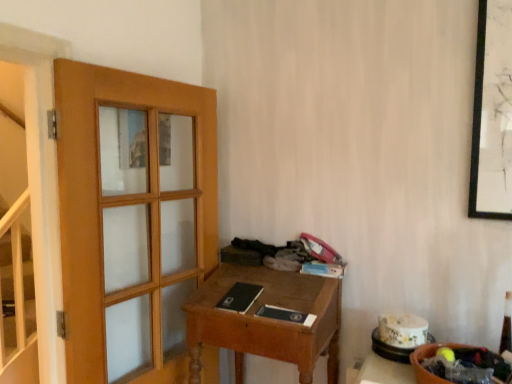
Question: Should I look upward or downward to see wooden desk at center?

Choices:
 (A) down
 (B) up

Answer: (A)

Question: Does white glossy stairwell at left appear on the right side of black matte book at center, the 3th book when ordered from right to left?

Choices:
 (A) no
 (B) yes

Answer: (A)

Question: Considering the relative positions of white glossy stairwell at left and black matte book at center, which appears as the 1th book when viewed from the left, in the image provided, is white glossy stairwell at left to the left of black matte book at center, which appears as the 1th book when viewed from the left, from the viewer's perspective?

Choices:
 (A) no
 (B) yes

Answer: (B)

Question: From a real-world perspective, is white glossy stairwell at left over black matte book at center, the 3th book when ordered from right to left?

Choices:
 (A) yes
 (B) no

Answer: (B)

Question: Is there a large distance between white glossy stairwell at left and black matte book at center, the 3th book when ordered from right to left?

Choices:
 (A) yes
 (B) no

Answer: (A)

Question: From the image's perspective, does white glossy stairwell at left appear lower than black matte book at center, which appears as the 1th book when viewed from the left?

Choices:
 (A) no
 (B) yes

Answer: (B)

Question: Is white glossy stairwell at left looking in the opposite direction of black matte book at center, the 3th book when ordered from right to left?

Choices:
 (A) no
 (B) yes

Answer: (B)

Question: From the image's perspective, does wooden desk at center appear lower than black matte book at center, which appears as the 1th book when viewed from the left?

Choices:
 (A) no
 (B) yes

Answer: (B)

Question: Considering the relative sizes of wooden desk at center and black matte book at center, the 3th book when ordered from right to left, in the image provided, is wooden desk at center smaller than black matte book at center, the 3th book when ordered from right to left,?

Choices:
 (A) yes
 (B) no

Answer: (B)

Question: Can you confirm if wooden desk at center is thinner than black matte book at center, the 3th book when ordered from right to left?

Choices:
 (A) yes
 (B) no

Answer: (B)

Question: Can you confirm if wooden desk at center is taller than black matte book at center, which appears as the 1th book when viewed from the left?

Choices:
 (A) no
 (B) yes

Answer: (B)

Question: Can you confirm if wooden desk at center is wider than black matte book at center, the 3th book when ordered from right to left?

Choices:
 (A) no
 (B) yes

Answer: (B)

Question: Is the depth of wooden desk at center less than that of black matte book at center, the 3th book when ordered from right to left?

Choices:
 (A) no
 (B) yes

Answer: (B)

Question: Is the position of matte blue book at center, arranged as the third book when viewed from the left, more distant than that of matte black book at center, which ranks as the 2th book in right-to-left order?

Choices:
 (A) no
 (B) yes

Answer: (B)